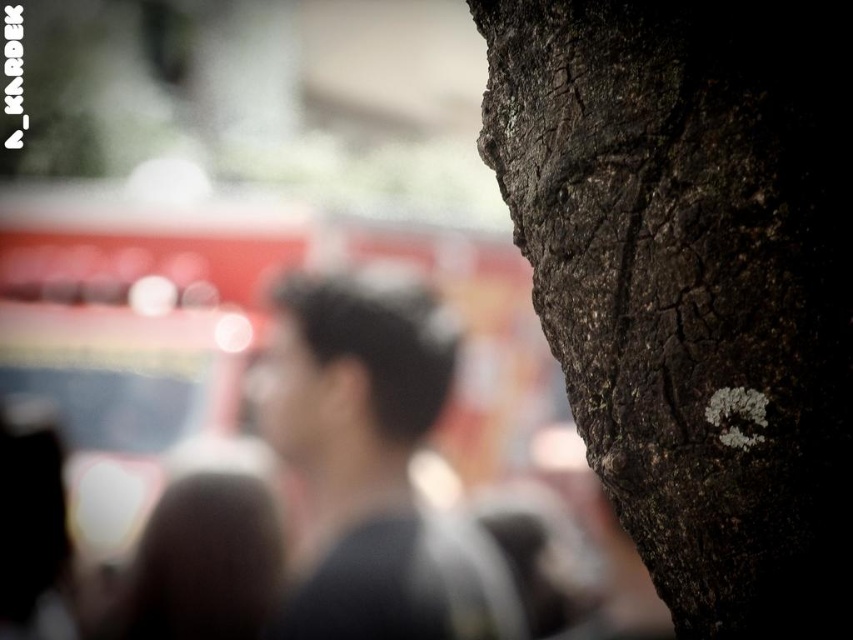
Question: In this image, where is dark brown rough bark at center located relative to dark gray hair at center?

Choices:
 (A) below
 (B) above

Answer: (B)

Question: Which of the following is the closest to the observer?

Choices:
 (A) (335, 397)
 (B) (805, 564)

Answer: (B)

Question: Can you confirm if dark brown rough bark at center is positioned below dark gray hair at center?

Choices:
 (A) no
 (B) yes

Answer: (A)

Question: In this image, where is dark brown rough bark at center located relative to dark gray hair at center?

Choices:
 (A) right
 (B) left

Answer: (A)

Question: Among these objects, which one is farthest from the camera?

Choices:
 (A) dark brown rough bark at center
 (B) dark gray hair at center

Answer: (B)